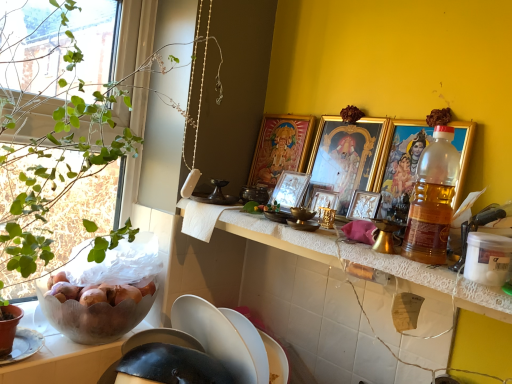
Question: Is metallic silver picture frame at center, the first picture frame in the back-to-front sequence, next to gold-framed picture at right, arranged as the 5th picture frame when viewed from the back, and touching it?

Choices:
 (A) yes
 (B) no

Answer: (B)

Question: From a real-world perspective, does metallic silver picture frame at center, the first picture frame in the back-to-front sequence, sit lower than gold-framed picture at right, arranged as the 5th picture frame when viewed from the back?

Choices:
 (A) yes
 (B) no

Answer: (A)

Question: Could you tell me if metallic silver picture frame at center, the first picture frame in the back-to-front sequence, is facing gold-framed picture at right, which is the 1th picture frame in front-to-back order?

Choices:
 (A) no
 (B) yes

Answer: (A)

Question: Is metallic silver picture frame at center, the first picture frame in the back-to-front sequence, wider than gold-framed picture at right, arranged as the 5th picture frame when viewed from the back?

Choices:
 (A) yes
 (B) no

Answer: (A)

Question: Is metallic silver picture frame at center, the first picture frame in the back-to-front sequence, not inside gold-framed picture at right, arranged as the 5th picture frame when viewed from the back?

Choices:
 (A) yes
 (B) no

Answer: (A)

Question: Is gold-framed picture at right, which is the 1th picture frame in front-to-back order, at the back of metallic silver picture frame at center, which appears as the 5th picture frame when viewed from the front?

Choices:
 (A) no
 (B) yes

Answer: (A)

Question: Does gold metallic picture frame at upper center, the 2th picture frame positioned from the front, have a lesser width compared to metallic silver picture frame at center, positioned as the third picture frame in front-to-back order?

Choices:
 (A) yes
 (B) no

Answer: (B)

Question: Is metallic silver picture frame at center, which is the 3th picture frame in back-to-front order, at the back of gold metallic picture frame at upper center, the fourth picture frame positioned from the back?

Choices:
 (A) no
 (B) yes

Answer: (B)

Question: From the image's perspective, is gold metallic picture frame at upper center, the fourth picture frame positioned from the back, above metallic silver picture frame at center, positioned as the third picture frame in front-to-back order?

Choices:
 (A) no
 (B) yes

Answer: (B)

Question: Can you confirm if gold metallic picture frame at upper center, the 2th picture frame positioned from the front, is taller than metallic silver picture frame at center, positioned as the third picture frame in front-to-back order?

Choices:
 (A) no
 (B) yes

Answer: (B)

Question: Is gold metallic picture frame at upper center, the fourth picture frame positioned from the back, smaller than metallic silver picture frame at center, positioned as the third picture frame in front-to-back order?

Choices:
 (A) no
 (B) yes

Answer: (A)

Question: Can you confirm if gold metallic picture frame at upper center, the fourth picture frame positioned from the back, is shorter than metallic silver picture frame at center, which is the 3th picture frame in back-to-front order?

Choices:
 (A) yes
 (B) no

Answer: (B)

Question: Is gold metallic picture frame at upper center, the 2th picture frame positioned from the front, facing away from metallic silver picture frame at center, the first picture frame in the back-to-front sequence?

Choices:
 (A) no
 (B) yes

Answer: (A)